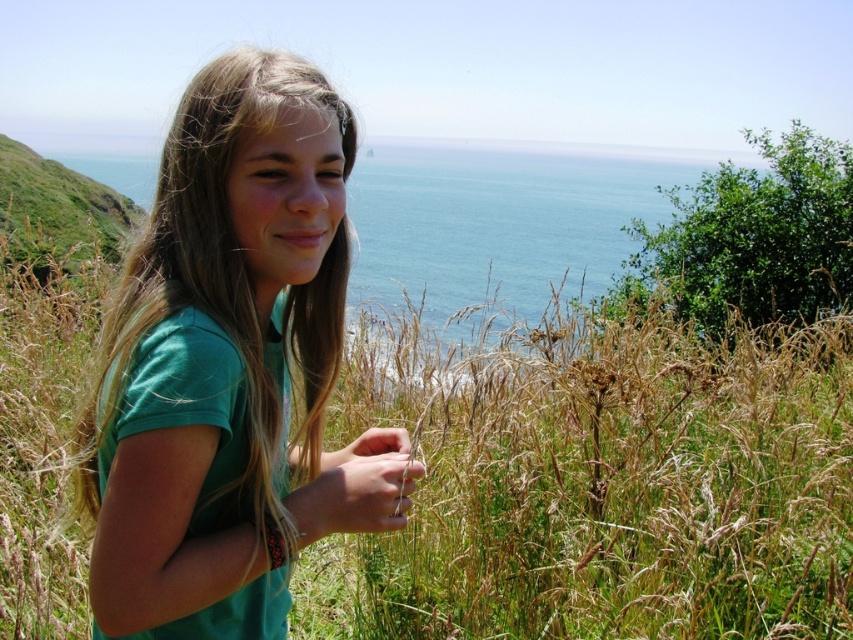
Question: Is dry grass at center smaller than green leafy plant at upper right?

Choices:
 (A) yes
 (B) no

Answer: (A)

Question: Estimate the real-world distances between objects in this image. Which object is farther from the blue water at upper center?

Choices:
 (A) green leafy plant at upper right
 (B) dry grass at center

Answer: (B)

Question: Which of the following is the farthest from the observer?

Choices:
 (A) (764, 230)
 (B) (22, 298)
 (C) (380, 202)
 (D) (263, 621)

Answer: (C)

Question: Is blue water at upper center bigger than green leafy plant at upper right?

Choices:
 (A) yes
 (B) no

Answer: (A)

Question: Which object is farther from the camera taking this photo?

Choices:
 (A) green leafy plant at upper right
 (B) blue water at upper center
 (C) dry grass at center
 (D) green matte shirt at center

Answer: (A)

Question: Considering the relative positions of dry grass at center and green leafy plant at upper right in the image provided, where is dry grass at center located with respect to green leafy plant at upper right?

Choices:
 (A) above
 (B) below

Answer: (B)